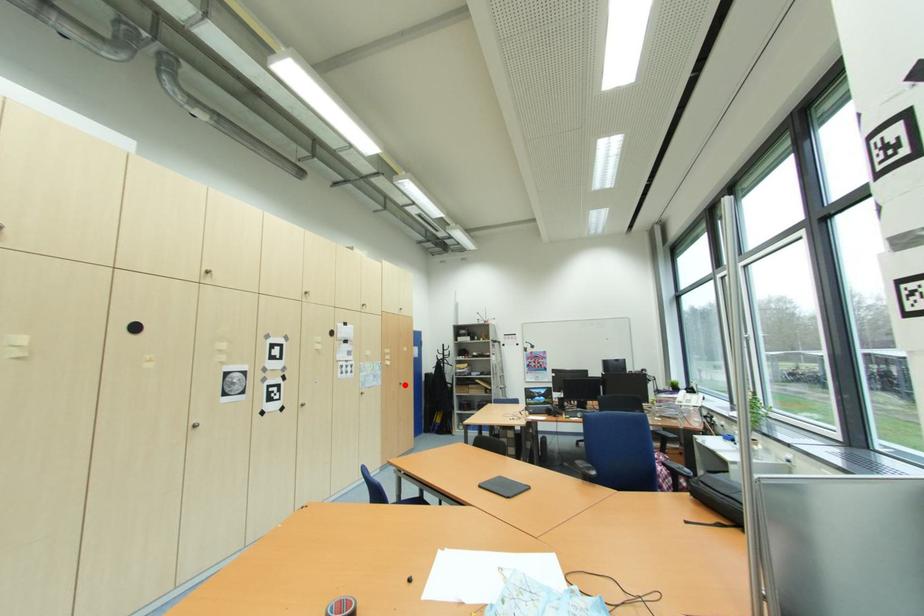
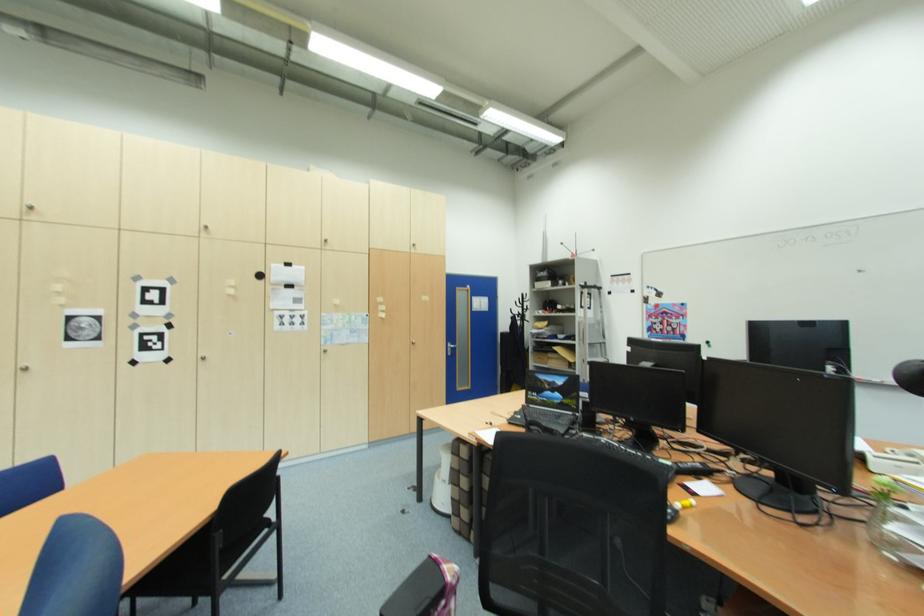
In the second image, find the point that corresponds to the highlighted location in the first image.

(418, 345)